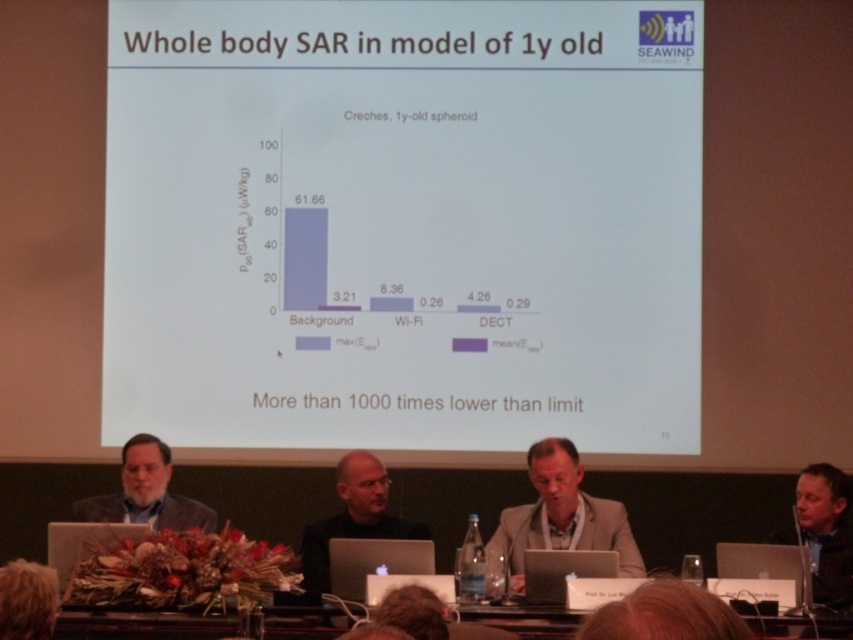
What does the point at the lower left of the graph labeled with coordinates [27,600] represent?

The point at the lower left of the graph labeled with coordinates [27,600] represents blonde hair at lower left.